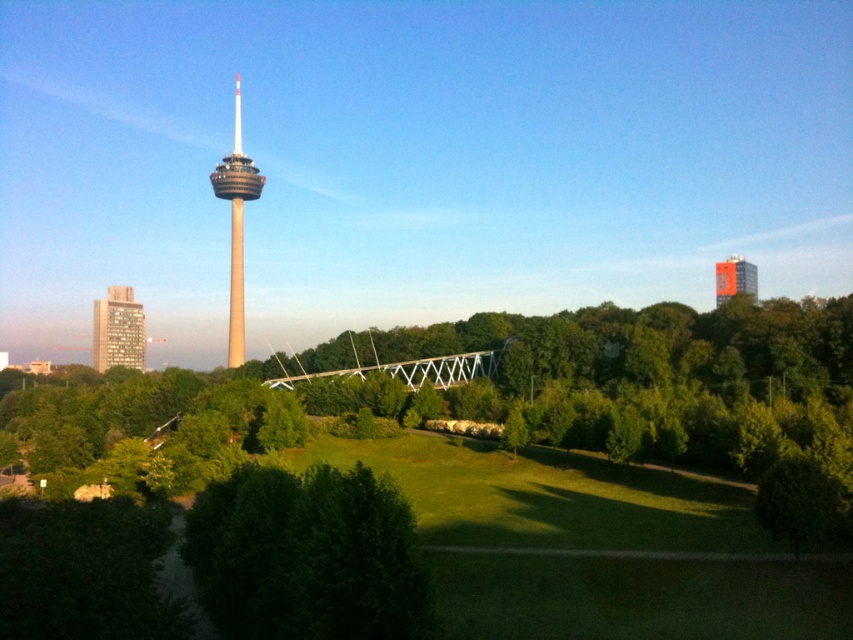
You are standing at point (144, 428) in the urban landscape. What object is located at this coordinate?

The green leafy tree at lower left is located at point (144, 428).

You are standing at the entrance of the park and see the green leafy tree at lower left and the matte brown building at left. Which one appears wider from your perspective?

The green leafy tree at lower left appears wider than the matte brown building at left because its width is larger.

Looking at this image, you are standing in the park and want to take a photo of both the green leafy tree at lower center and the green leafy tree at lower left. Which tree should you position yourself closer to in order to capture both in a single frame?

To capture both the green leafy tree at lower center and the green leafy tree at lower left in a single frame, you should position yourself closer to the green leafy tree at lower left since the green leafy tree at lower center is above it, requiring a wider angle or a step back to include both.